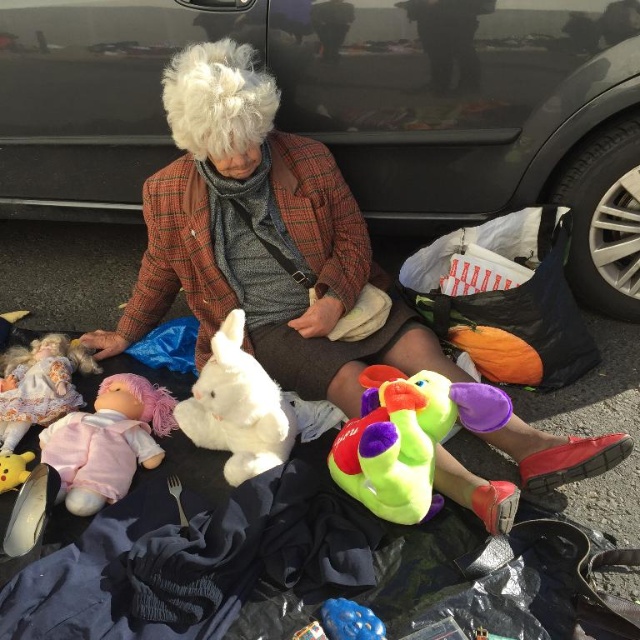
You are a visitor at a toy store and see the black glossy car at upper center and the matte pink doll at lower left. Which object is closer to you?

The black glossy car at upper center is closer to you because it is in front of the matte pink doll at lower left.

You are a toy collector who wants to display the soft pink fabric doll at lower left and the matte pink doll at lower left on a shelf. Since both are at the lower left, how are they arranged vertically?

The soft pink fabric doll at lower left is below the matte pink doll at lower left, so it is positioned lower on the shelf.